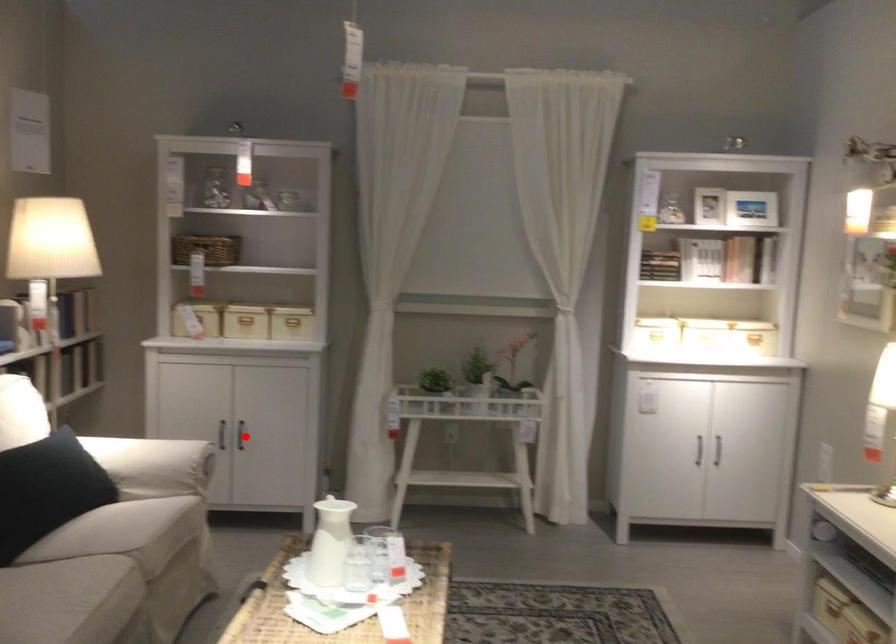
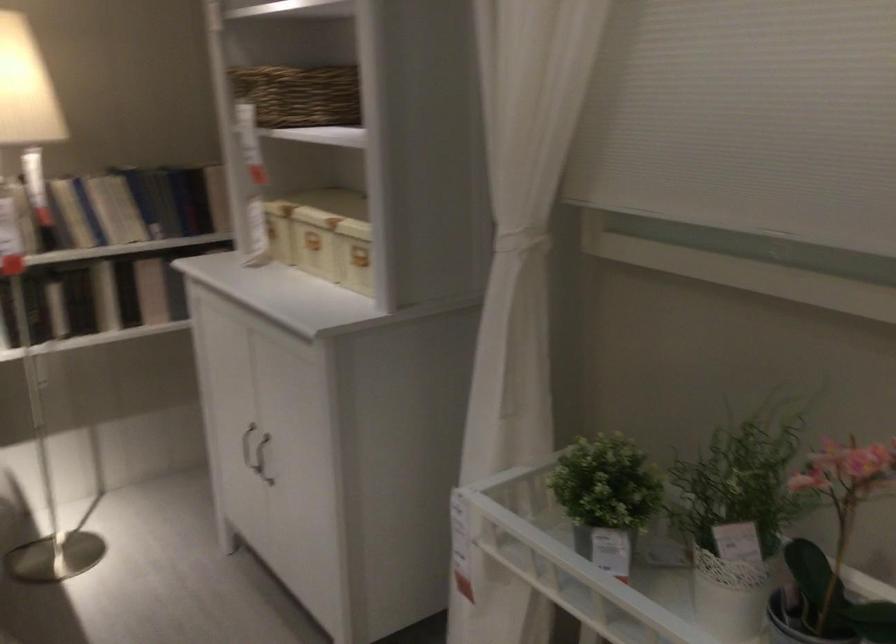
Find the pixel in the second image that matches the highlighted location in the first image.

(262, 459)